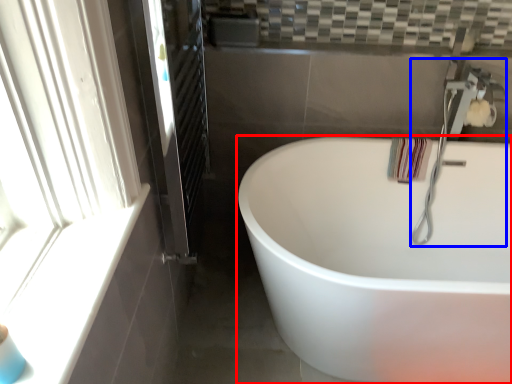
Question: Which object appears farthest to the camera in this image, bathtub (highlighted by a red box) or faucet (highlighted by a blue box)?

Choices:
 (A) bathtub
 (B) faucet

Answer: (B)